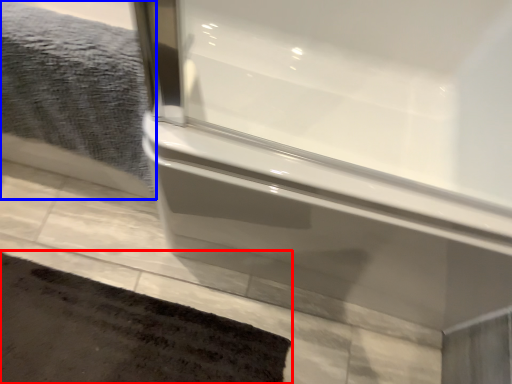
Question: Which of the following is the farthest to the observer, bath mat (highlighted by a red box) or bath towel (highlighted by a blue box)?

Choices:
 (A) bath mat
 (B) bath towel

Answer: (A)